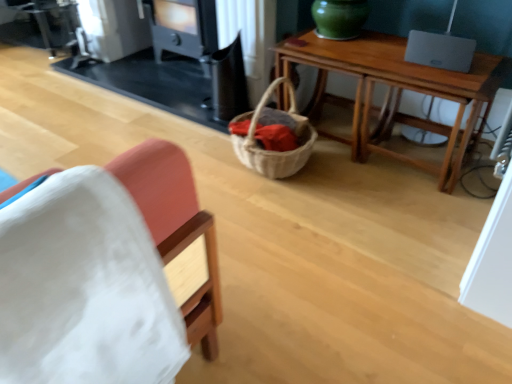
Question: Can you confirm if white fabric chair at left is shorter than wooden table at center?

Choices:
 (A) no
 (B) yes

Answer: (A)

Question: Is white fabric chair at left aimed at wooden table at center?

Choices:
 (A) no
 (B) yes

Answer: (A)

Question: Does white fabric chair at left appear on the right side of wooden table at center?

Choices:
 (A) no
 (B) yes

Answer: (A)

Question: Is there a large distance between white fabric chair at left and wooden table at center?

Choices:
 (A) yes
 (B) no

Answer: (A)

Question: Is white fabric chair at left directly adjacent to wooden table at center?

Choices:
 (A) yes
 (B) no

Answer: (B)

Question: Is the position of white fabric chair at left less distant than that of wooden table at center?

Choices:
 (A) yes
 (B) no

Answer: (A)

Question: From a real-world perspective, is wooden table at center located higher than black matte fireplace at upper center?

Choices:
 (A) no
 (B) yes

Answer: (A)

Question: Is black matte fireplace at upper center inside wooden table at center?

Choices:
 (A) no
 (B) yes

Answer: (A)

Question: Is wooden table at center wider than black matte fireplace at upper center?

Choices:
 (A) no
 (B) yes

Answer: (A)

Question: Is wooden table at center in contact with black matte fireplace at upper center?

Choices:
 (A) no
 (B) yes

Answer: (A)

Question: Does wooden table at center appear on the right side of black matte fireplace at upper center?

Choices:
 (A) yes
 (B) no

Answer: (A)

Question: Could you tell me if wooden table at center is facing black matte fireplace at upper center?

Choices:
 (A) yes
 (B) no

Answer: (B)

Question: Does white fabric chair at left have a larger size compared to black matte fireplace at upper center?

Choices:
 (A) yes
 (B) no

Answer: (B)